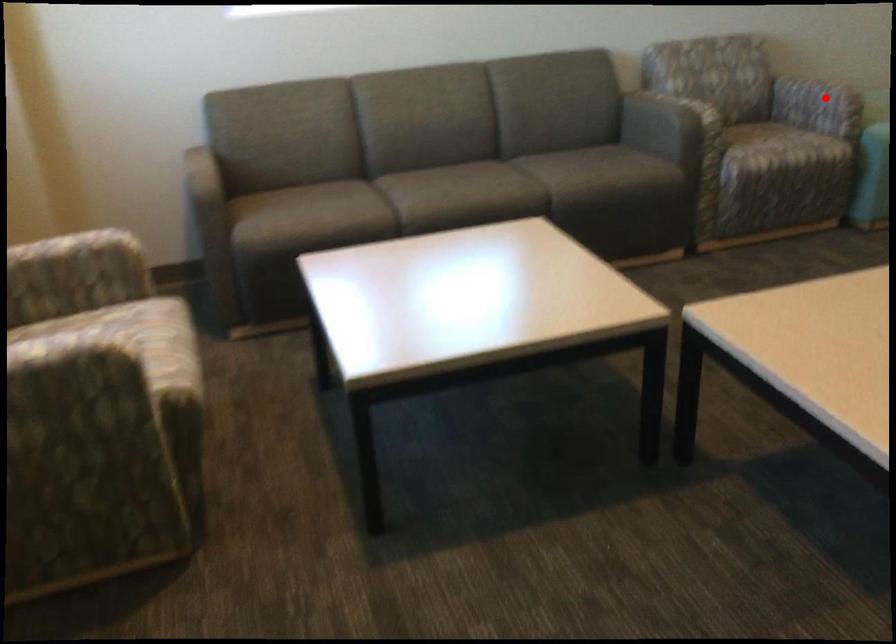
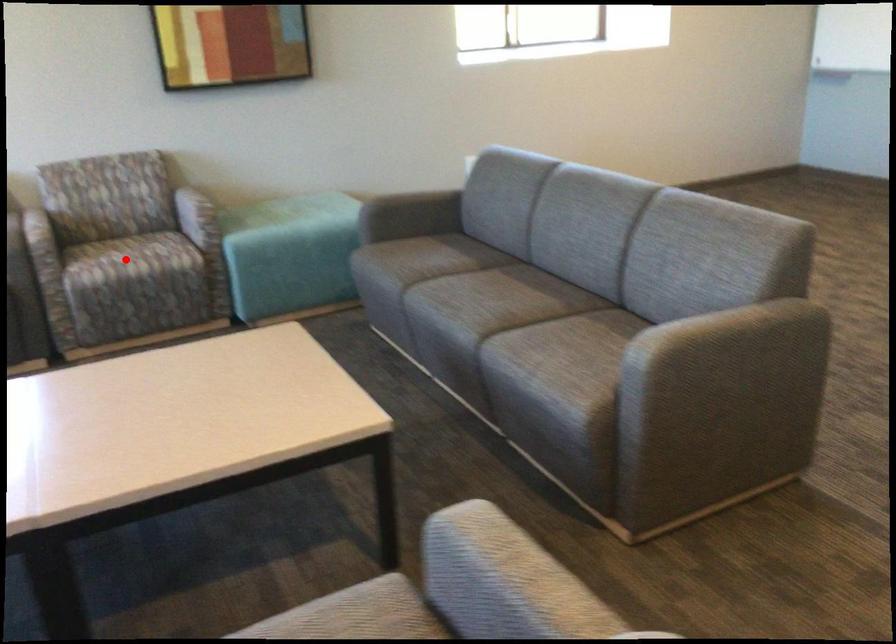
I am providing you with two images of the same scene from different viewpoints. A red point is marked on the first image and another point is marked on the second image. Do the highlighted points in image1 and image2 indicate the same real-world spot?

No